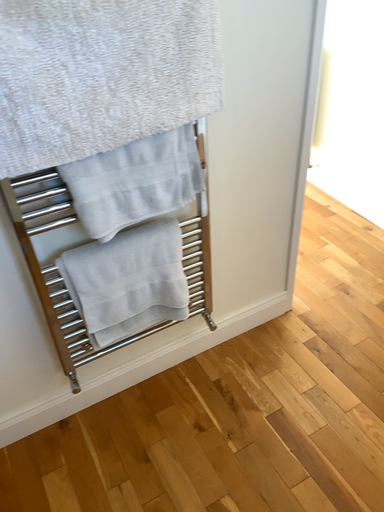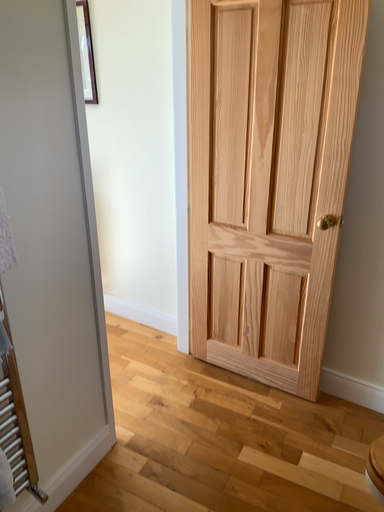
Question: How did the camera likely rotate when shooting the video?

Choices:
 (A) rotated upward
 (B) rotated downward

Answer: (A)